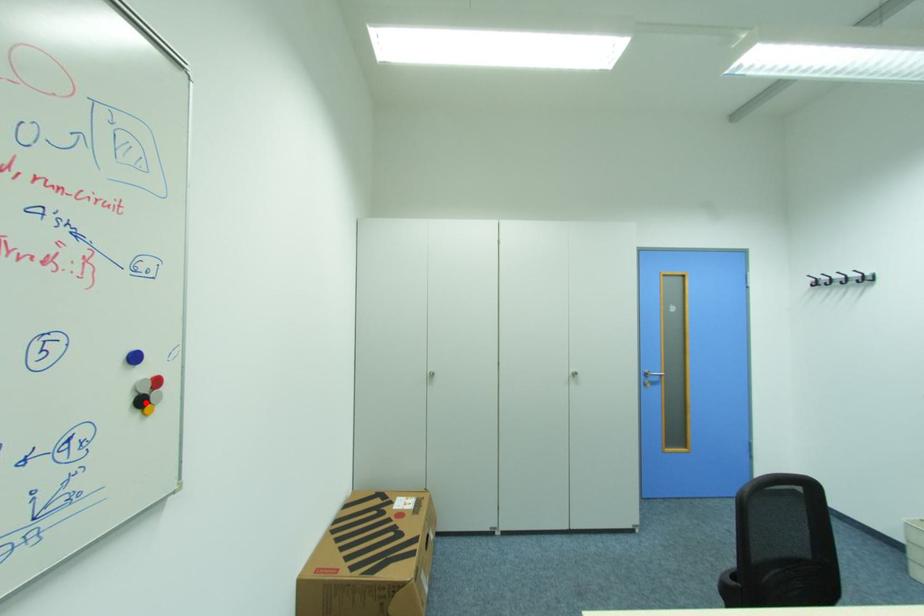
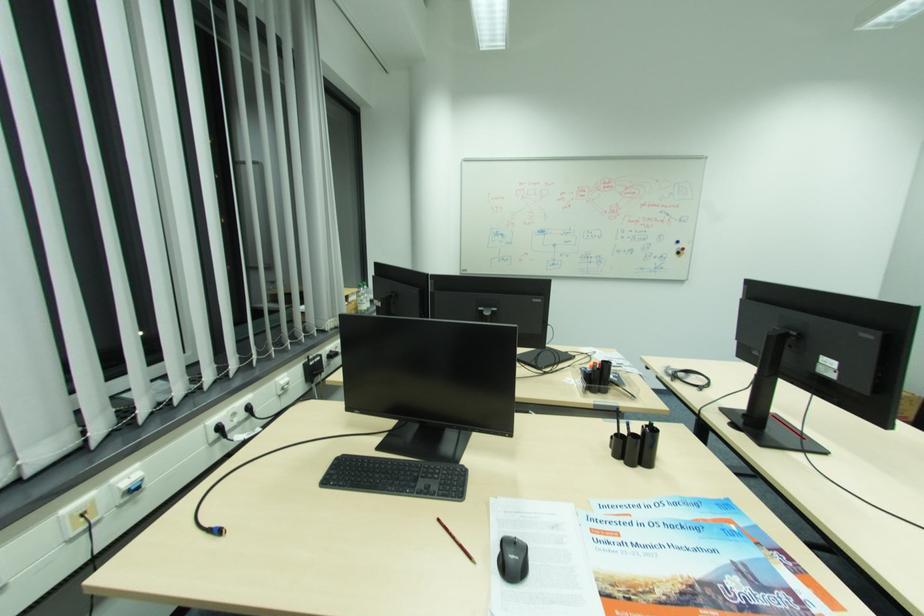
Find the pixel in the second image that matches the highlighted location in the first image.

(684, 253)